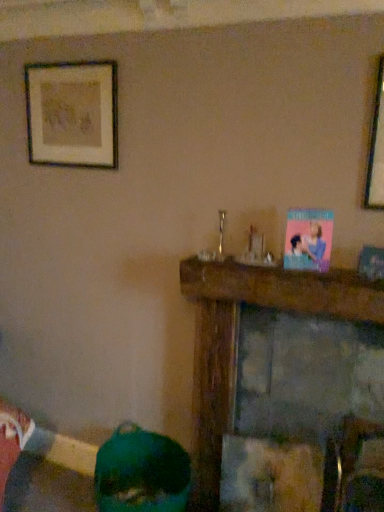
Question: Can you confirm if green matte vase at lower left is shorter than wooden framed artwork at upper left?

Choices:
 (A) yes
 (B) no

Answer: (A)

Question: Considering the relative positions of green matte vase at lower left and wooden framed artwork at upper left in the image provided, is green matte vase at lower left to the right of wooden framed artwork at upper left from the viewer's perspective?

Choices:
 (A) yes
 (B) no

Answer: (A)

Question: From a real-world perspective, does green matte vase at lower left sit lower than wooden framed artwork at upper left?

Choices:
 (A) no
 (B) yes

Answer: (B)

Question: Does green matte vase at lower left lie behind wooden framed artwork at upper left?

Choices:
 (A) yes
 (B) no

Answer: (B)

Question: Can you confirm if green matte vase at lower left is taller than wooden framed artwork at upper left?

Choices:
 (A) yes
 (B) no

Answer: (B)

Question: From the image's perspective, is green matte vase at lower left located above or below wooden framed artwork at upper left?

Choices:
 (A) above
 (B) below

Answer: (B)

Question: Is green matte vase at lower left inside the boundaries of wooden framed artwork at upper left, or outside?

Choices:
 (A) inside
 (B) outside

Answer: (B)

Question: From a real-world perspective, is green matte vase at lower left positioned above or below wooden framed artwork at upper left?

Choices:
 (A) above
 (B) below

Answer: (B)

Question: Is green matte vase at lower left in front of or behind wooden framed artwork at upper left in the image?

Choices:
 (A) front
 (B) behind

Answer: (A)

Question: In terms of width, does green matte vase at lower left look wider or thinner when compared to wooden mantel at center?

Choices:
 (A) thin
 (B) wide

Answer: (B)

Question: Considering the positions of green matte vase at lower left and wooden mantel at center in the image, is green matte vase at lower left taller or shorter than wooden mantel at center?

Choices:
 (A) tall
 (B) short

Answer: (B)

Question: Based on their sizes in the image, would you say green matte vase at lower left is bigger or smaller than wooden mantel at center?

Choices:
 (A) big
 (B) small

Answer: (B)

Question: Considering the relative positions of green matte vase at lower left and wooden mantel at center in the image provided, is green matte vase at lower left to the left or to the right of wooden mantel at center?

Choices:
 (A) right
 (B) left

Answer: (B)

Question: Looking at the image, does wooden mantel at center seem bigger or smaller compared to wooden framed artwork at upper left?

Choices:
 (A) small
 (B) big

Answer: (B)

Question: Is wooden mantel at center wider or thinner than wooden framed artwork at upper left?

Choices:
 (A) wide
 (B) thin

Answer: (A)